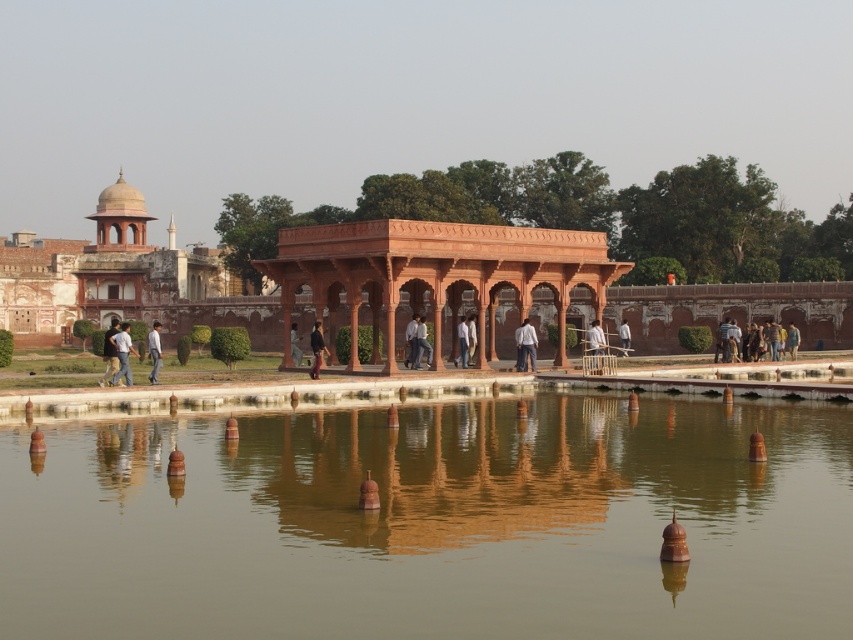
Between light brown wooden chair at center and light brown wooden pole at center, which one has more height?

light brown wooden pole at center

Does light brown wooden chair at center lie behind light brown wooden pole at center?

No, light brown wooden chair at center is closer to the viewer.

The height and width of the screenshot is (640, 853). In order to click on light brown wooden chair at center in this screenshot , I will do `click(595, 344)`.

Is brown reflective water at center below dark blue jeans at left?

Yes.

The width and height of the screenshot is (853, 640). Describe the element at coordinates (434, 524) in the screenshot. I see `brown reflective water at center` at that location.

Find the location of a particular element. The image size is (853, 640). brown reflective water at center is located at coordinates (434, 524).

Is light brown fabric shirt at left below light brown fabric pants at lower left?

Incorrect, light brown fabric shirt at left is not positioned below light brown fabric pants at lower left.

Can you confirm if light brown fabric shirt at left is positioned to the left of light brown fabric pants at lower left?

Correct, you'll find light brown fabric shirt at left to the left of light brown fabric pants at lower left.

Does point (120, 330) come closer to viewer compared to point (154, 346)?

That is True.

Identify the location of light brown fabric shirt at left. The height and width of the screenshot is (640, 853). (122, 355).